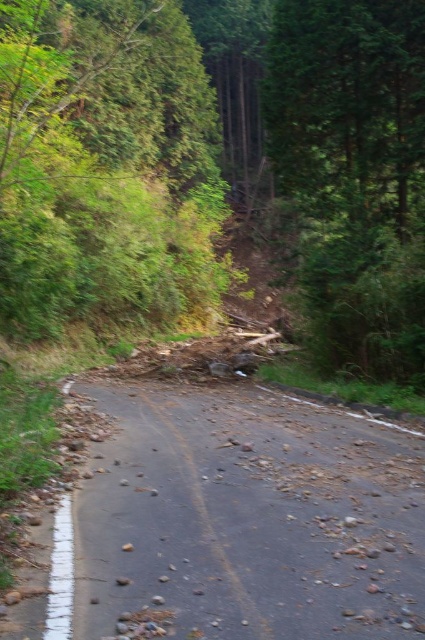
I want to click on green leafy tree at upper left, so click(104, 164).

Which is in front, point (42, 45) or point (353, 355)?

Positioned in front is point (353, 355).

Locate an element on the screen. green leafy tree at upper left is located at coordinates (104, 164).

Who is taller, dull asphalt road at center or green leafy tree at upper left?

Standing taller between the two is green leafy tree at upper left.

At what (x,y) coordinates should I click in order to perform the action: click on dull asphalt road at center. Please return your answer as a coordinate pair (x, y). This screenshot has height=640, width=425. Looking at the image, I should click on tap(244, 522).

What do you see at coordinates (244, 522) in the screenshot? I see `dull asphalt road at center` at bounding box center [244, 522].

Find the location of a particular element. The image size is (425, 640). dull asphalt road at center is located at coordinates (244, 522).

Is point (407, 545) in front of point (397, 51)?

Yes, it is in front of point (397, 51).

What do you see at coordinates (244, 522) in the screenshot? The width and height of the screenshot is (425, 640). I see `dull asphalt road at center` at bounding box center [244, 522].

You are a GUI agent. You are given a task and a screenshot of the screen. Output one action in this format:
    pyautogui.click(x=<x>, y=<y>)
    Task: Click on the dull asphalt road at center
    
    Given the screenshot: What is the action you would take?
    pyautogui.click(x=244, y=522)